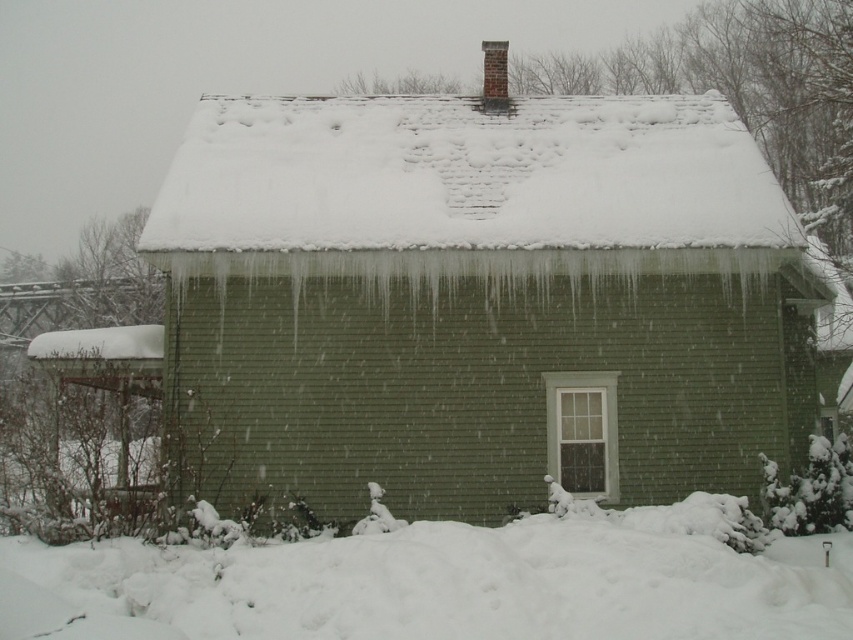
You are a delivery person trying to deliver a package to the house. You see the white shingles at upper center and the white fluffy snow at lower center. Which one is taller?

The white shingles at upper center has a greater height compared to the white fluffy snow at lower center, so the white shingles at upper center is taller.

Looking at this image, you are standing in front of the house and notice the white shingles at upper center. Can you determine their exact position on the roof?

The white shingles at upper center are located at point coordinates of (467, 176).

Based on the photo, you are a delivery person trying to deliver a package to the house. You notice the white shingles at upper center and the white fluffy snow at lower center. Which of these two items is bigger in size?

The white shingles at upper center has a larger size compared to the white fluffy snow at lower center.